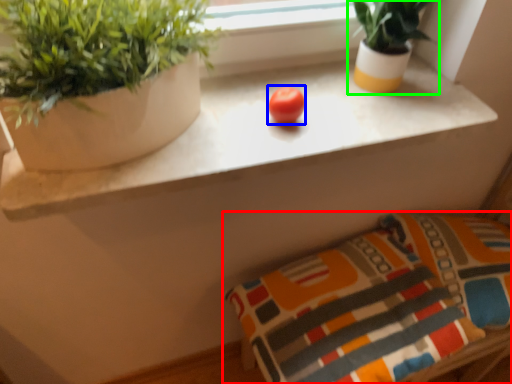
Question: Which object is positioned farthest from pillow (highlighted by a red box)? Select from fruit (highlighted by a blue box) and houseplant (highlighted by a green box).

Choices:
 (A) fruit
 (B) houseplant

Answer: (A)